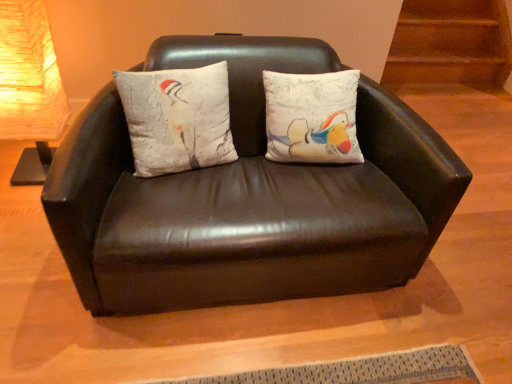
Question: Is matte black couch at center further to camera compared to matte white lampshade at left?

Choices:
 (A) no
 (B) yes

Answer: (A)

Question: From a real-world perspective, is matte black couch at center on top of matte white lampshade at left?

Choices:
 (A) yes
 (B) no

Answer: (B)

Question: From the image's perspective, is matte black couch at center located beneath matte white lampshade at left?

Choices:
 (A) yes
 (B) no

Answer: (A)

Question: From a real-world perspective, is matte black couch at center below matte white lampshade at left?

Choices:
 (A) yes
 (B) no

Answer: (A)

Question: Is matte black couch at center facing towards matte white lampshade at left?

Choices:
 (A) no
 (B) yes

Answer: (A)

Question: Is matte black couch at center smaller than matte white lampshade at left?

Choices:
 (A) no
 (B) yes

Answer: (A)

Question: From a real-world perspective, is matte white lampshade at left over matte black couch at center?

Choices:
 (A) yes
 (B) no

Answer: (A)

Question: Does matte white lampshade at left lie in front of matte black couch at center?

Choices:
 (A) no
 (B) yes

Answer: (A)

Question: Considering the relative sizes of matte white lampshade at left and matte black couch at center in the image provided, is matte white lampshade at left taller than matte black couch at center?

Choices:
 (A) yes
 (B) no

Answer: (A)

Question: Is matte white lampshade at left located outside matte black couch at center?

Choices:
 (A) no
 (B) yes

Answer: (B)

Question: Can you confirm if matte white lampshade at left is thinner than matte black couch at center?

Choices:
 (A) no
 (B) yes

Answer: (B)

Question: Can you confirm if matte white lampshade at left is wider than matte black couch at center?

Choices:
 (A) no
 (B) yes

Answer: (A)

Question: Is textured white pillow with bird design at center to the right of matte black couch at center from the viewer's perspective?

Choices:
 (A) yes
 (B) no

Answer: (B)